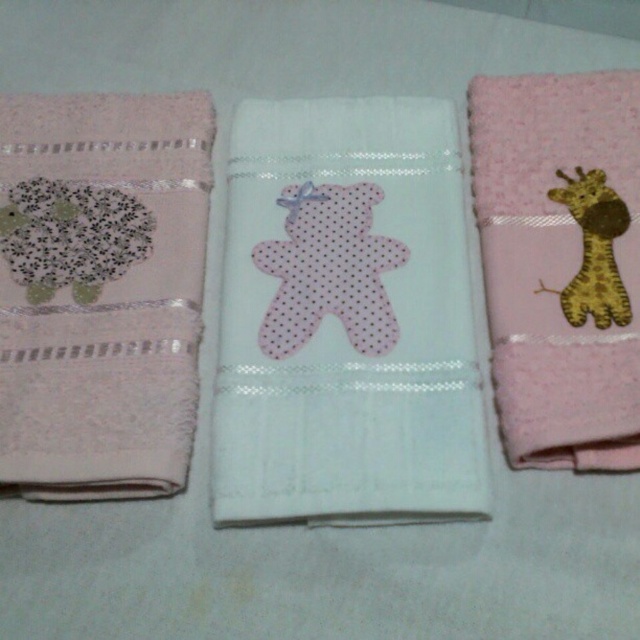
Which object corresponds to the point at coordinates [561,262]?

The pink fluffy towel with giraffe at right corresponds to the point at coordinates [561,262].

You are a delivery robot that needs to place a new towel on the counter. The new towel is 12 inches wide. The existing towels are the white textured towel with teddy bear at center and the brown felt giraffe at right. Can you fit the new towel between them without moving the existing ones?

The distance between the white textured towel with teddy bear at center and the brown felt giraffe at right is 11.79 inches. Since the new towel is 12 inches wide, it cannot fit between them as the space is slightly narrower than the towel.